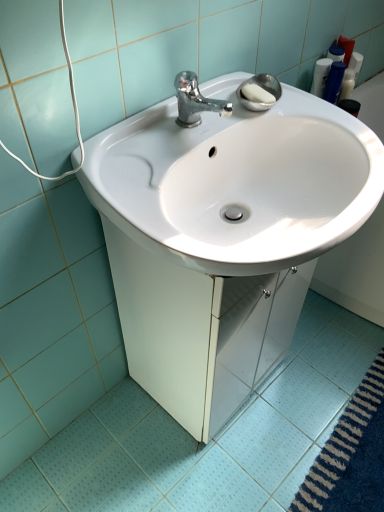
The image size is (384, 512). In order to click on free point above white glossy ceramic tile at lower center (from a real-world perspective) in this screenshot , I will do `click(259, 431)`.